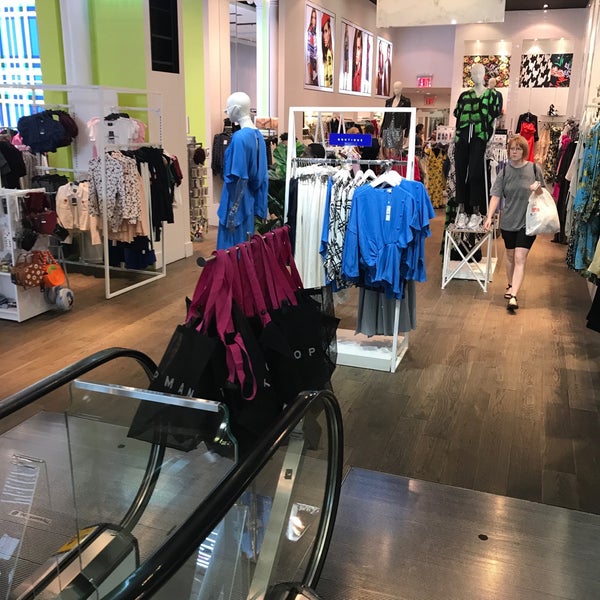
Locate an element on the screen. The width and height of the screenshot is (600, 600). art on wall is located at coordinates click(363, 63), click(500, 60), click(535, 88).